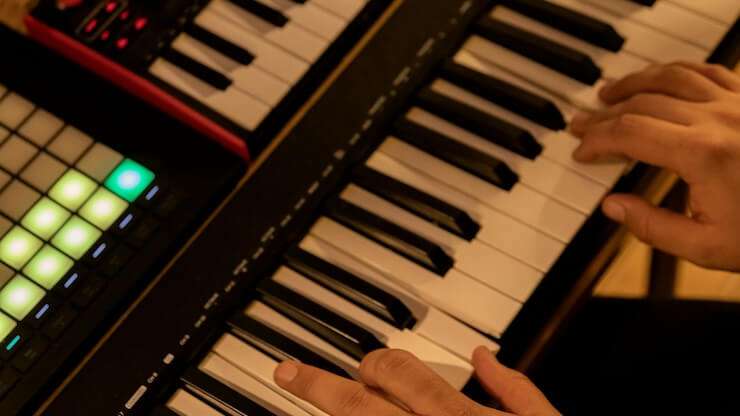
Locate an element on the screen. The height and width of the screenshot is (416, 740). keys on the upper keyboard is located at coordinates (234, 104), (218, 78), (260, 81), (243, 49), (277, 59), (297, 37), (275, 14), (311, 15), (340, 5).